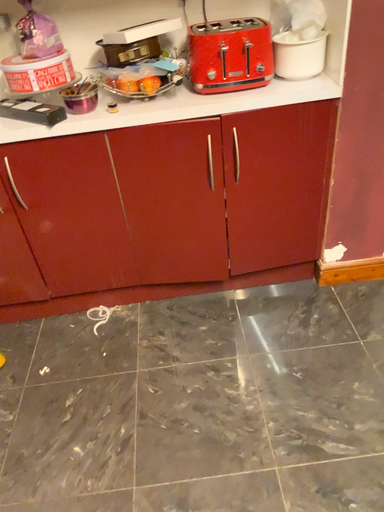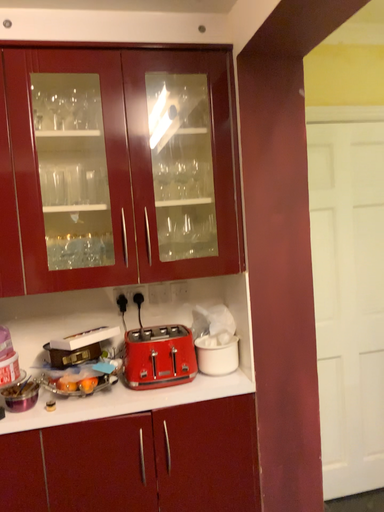
Question: Which way did the camera rotate in the video?

Choices:
 (A) rotated downward
 (B) rotated upward

Answer: (B)